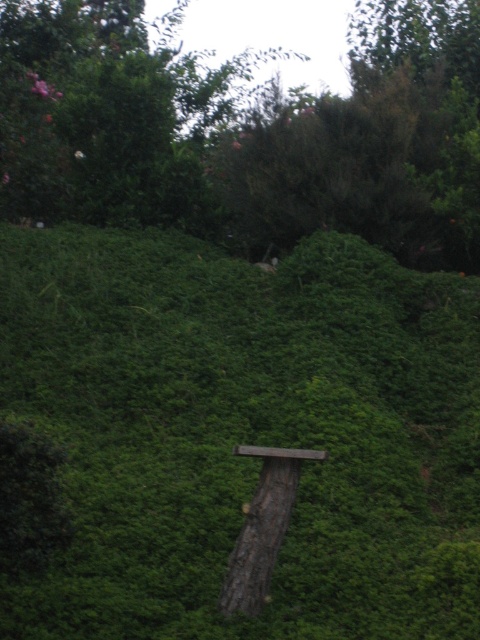
You are standing in the middle of a garden and see a wooden post in the center. There is a point marked at coordinates (x=244, y=433). What does this point indicate?

The point at coordinates (x=244, y=433) marks the green leafy hedge at center.

You are a gardener planning to trim both the green leafy hedge at center and the brown rough tree trunk at center. Which one do you need to adjust your ladder height for first?

The green leafy hedge at center is taller than the brown rough tree trunk at center, so you need to adjust your ladder height for the green leafy hedge at center first.